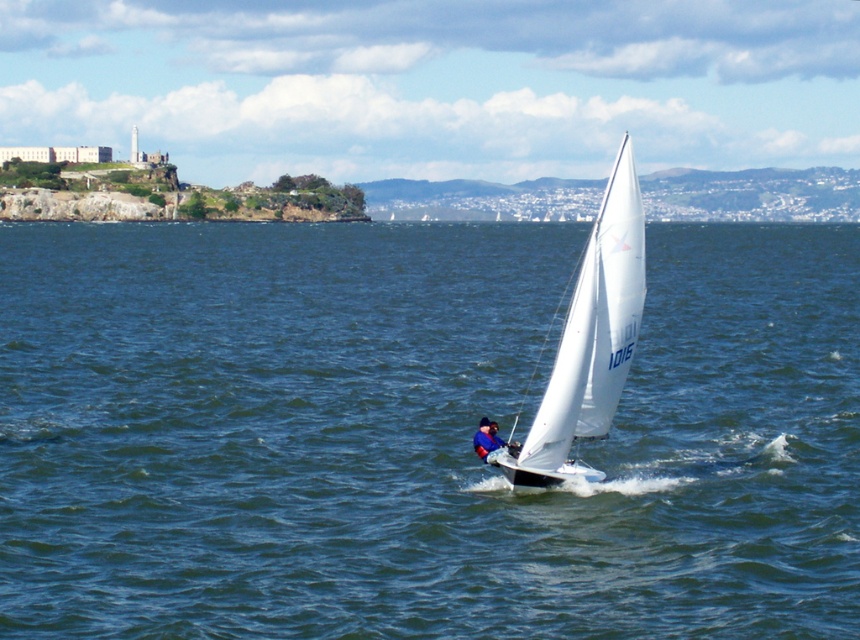
This screenshot has width=860, height=640. In order to click on blue water at center in this screenshot , I will do `click(416, 435)`.

Does blue water at center appear on the right side of white sailboat at center?

In fact, blue water at center is to the left of white sailboat at center.

Image resolution: width=860 pixels, height=640 pixels. Find the location of `blue water at center`. blue water at center is located at coordinates (416, 435).

Image resolution: width=860 pixels, height=640 pixels. I want to click on blue water at center, so click(416, 435).

Does blue water at center appear over blue fabric sailboat at center?

Indeed, blue water at center is positioned over blue fabric sailboat at center.

Is point (302, 372) farther from camera compared to point (478, 445)?

Yes.

The image size is (860, 640). In order to click on blue water at center in this screenshot , I will do `click(416, 435)`.

Is the position of white sailboat at center more distant than that of blue fabric sailboat at center?

→ No, it is in front of blue fabric sailboat at center.

Identify the location of white sailboat at center. The height and width of the screenshot is (640, 860). (590, 339).